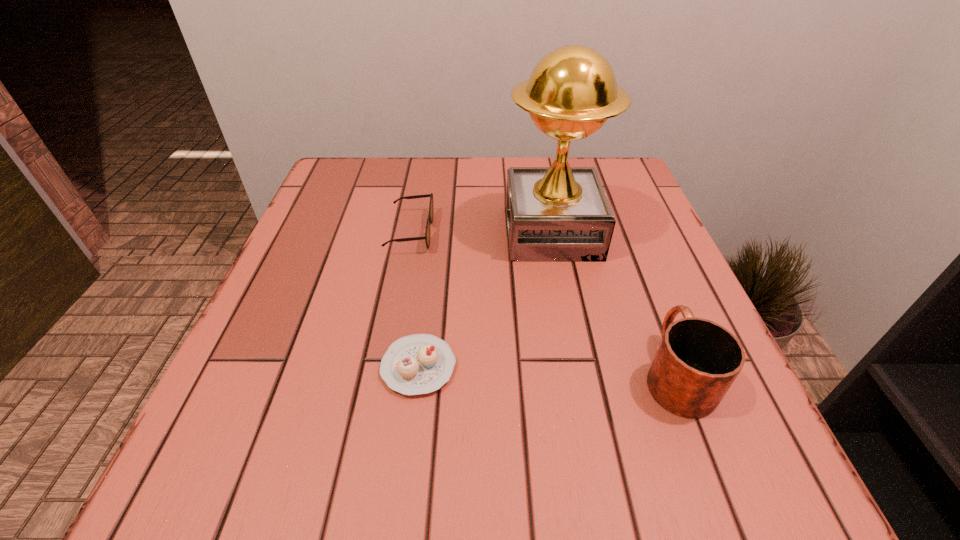
You are a GUI agent. You are given a task and a screenshot of the screen. Output one action in this format:
    pyautogui.click(x=<x>, y=<y>)
    Task: Click on the tallest object
    This screenshot has height=540, width=960.
    Given the screenshot: What is the action you would take?
    pyautogui.click(x=560, y=213)

Identify the location of the second tallest object. (x=697, y=361).

Find the location of a particular element. the second shortest object is located at coordinates (430, 216).

Find the location of a particular element. The height and width of the screenshot is (540, 960). the shortest object is located at coordinates (416, 364).

Identify the location of free space located on the front-facing side of the tallest object. (420, 233).

Image resolution: width=960 pixels, height=540 pixels. I want to click on vacant area located on the front-facing side of the tallest object, so click(x=420, y=233).

The width and height of the screenshot is (960, 540). Identify the location of free space located 0.300m on the front-facing side of the tallest object. (364, 233).

This screenshot has height=540, width=960. Identify the location of vacant space situated on the side of the third shortest object with the handle. (626, 244).

Locate an element on the screen. The height and width of the screenshot is (540, 960). free location located 0.070m on the side of the third shortest object with the handle is located at coordinates (649, 304).

Where is `vacant point located on the side of the third shortest object with the handle`? vacant point located on the side of the third shortest object with the handle is located at coordinates (633, 260).